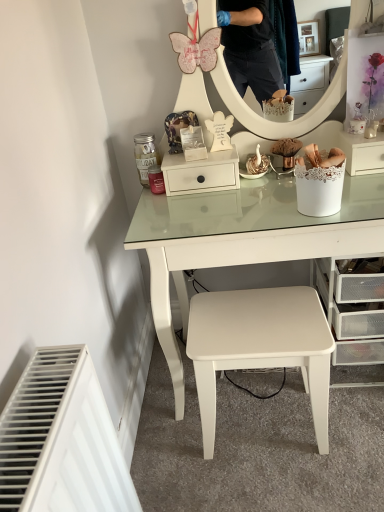
Question: Considering the positions of point (344, 134) and point (233, 175), is point (344, 134) closer or farther from the camera than point (233, 175)?

Choices:
 (A) farther
 (B) closer

Answer: (A)

Question: Would you say white lace-covered basket at right, which is the 1th shelf in right-to-left order, is to the left or to the right of white matte drawer at center, positioned as the 1th shelf in left-to-right order, in the picture?

Choices:
 (A) right
 (B) left

Answer: (A)

Question: Estimate the real-world distances between objects in this image. Which object is farther from the white matte stool at center?

Choices:
 (A) white matte drawer at center, positioned as the 1th shelf in left-to-right order
 (B) white lace-covered basket at right, which is the 1th shelf in right-to-left order

Answer: (B)

Question: Based on their relative distances, which object is farther from the white lace-covered basket at right, arranged as the second shelf when viewed from the left?

Choices:
 (A) white matte drawer at center, positioned as the 1th shelf in left-to-right order
 (B) white matte stool at center

Answer: (B)